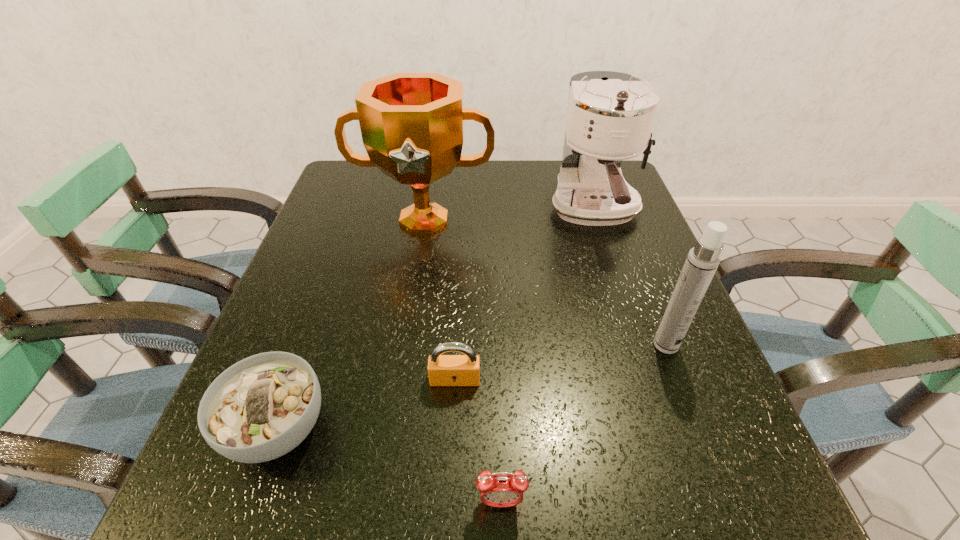
Locate an element on the screen. The image size is (960, 540). free space that satisfies the following two spatial constraints: 1. on the side of the fourth shortest object with the star emblem; 2. on the right side of the award is located at coordinates (404, 345).